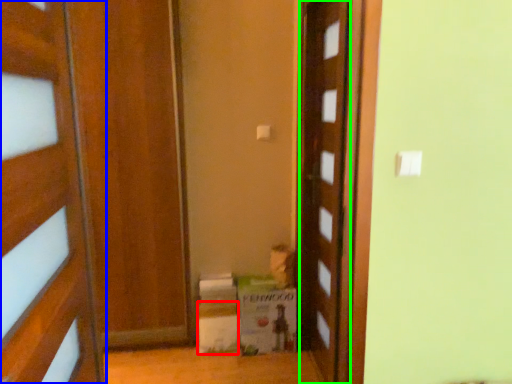
Question: Estimate the real-world distances between objects in this image. Which object is farther from cardboard box (highlighted by a red box), door (highlighted by a blue box) or door (highlighted by a green box)?

Choices:
 (A) door
 (B) door

Answer: (A)